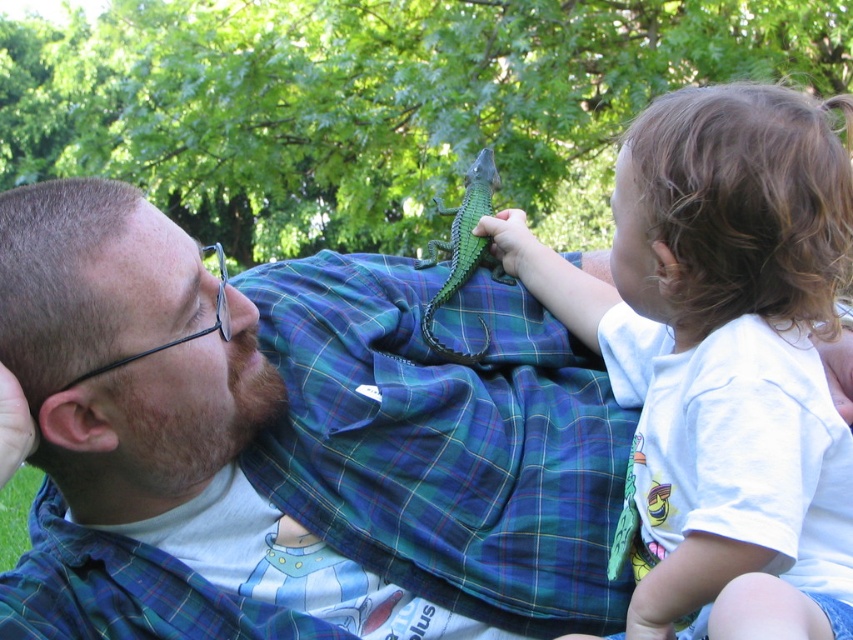
Based on the photo, which is more to the right, green matte toy lizard at upper center or curly brown hair at upper right?

curly brown hair at upper right is more to the right.

Which is behind, point (488, 493) or point (752, 400)?

Point (488, 493)

Locate an element on the screen. The width and height of the screenshot is (853, 640). green matte toy lizard at upper center is located at coordinates (292, 444).

Is green matte toy lizard at upper center in front of green matte toy lizard at center?

Yes, green matte toy lizard at upper center is closer to the viewer.

How far apart are green matte toy lizard at upper center and green matte toy lizard at center?

green matte toy lizard at upper center is 37.56 centimeters from green matte toy lizard at center.

Is point (305, 390) farther from camera compared to point (492, 160)?

No, (305, 390) is closer to viewer.

The height and width of the screenshot is (640, 853). Find the location of `green matte toy lizard at upper center`. green matte toy lizard at upper center is located at coordinates (292, 444).

Does curly brown hair at upper right have a larger size compared to green matte toy lizard at center?

Indeed, curly brown hair at upper right has a larger size compared to green matte toy lizard at center.

Who is positioned more to the right, curly brown hair at upper right or green matte toy lizard at center?

From the viewer's perspective, curly brown hair at upper right appears more on the right side.

The image size is (853, 640). Find the location of `curly brown hair at upper right`. curly brown hair at upper right is located at coordinates (723, 355).

Image resolution: width=853 pixels, height=640 pixels. I want to click on curly brown hair at upper right, so click(x=723, y=355).